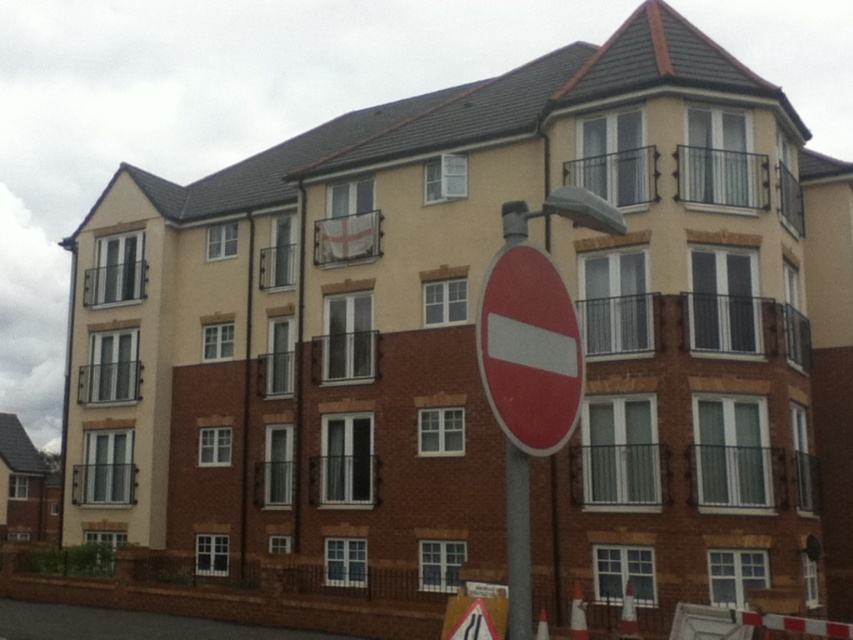
You are standing in front of the residential building and notice two points marked on the facade. The first point is at coordinates point [569,404] and the second is at point [511,502]. Which point is closer to you?

Point [569,404] is further to the camera than point [511,502], so the second point is closer to you.

You are standing in front of the residential building and see a point at coordinates (529,349). What object is located at that point?

The point at coordinates (529,349) indicates the red matte sign at center.

You are standing in front of the residential building and notice the red matte sign at center. Based on its coordinates, can you determine if it is closer to the top or bottom of the image?

The red matte sign at center is located at coordinates point (529,349). Since the y coordinate is 0.621, which is closer to 1.0 than to 0.0, the red matte sign at center is closer to the bottom of the image.